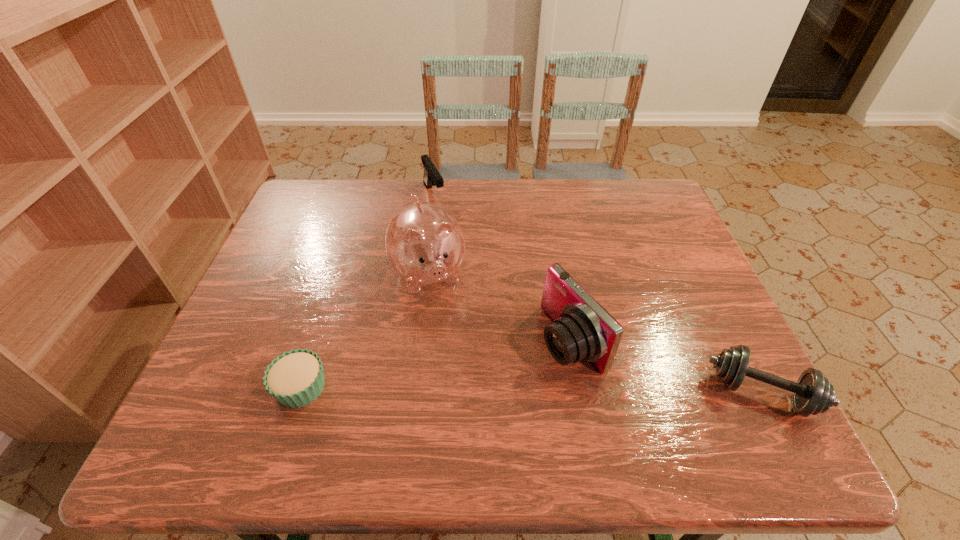
Locate an element on the screen. Image resolution: width=960 pixels, height=540 pixels. free space on the desktop that is between the cupcake and the dumbbell and is positioned on the front-facing side of the second object from right to left is located at coordinates (473, 389).

Find the location of a particular element. free spot on the desktop that is between the cupcake and the dumbbell and is positioned on the front-facing side of the pistol is located at coordinates (552, 390).

Find the location of a particular element. The image size is (960, 540). free space on the desktop that is between the cupcake and the dumbbell and is positioned on the front facing side of the piggy bank is located at coordinates (469, 389).